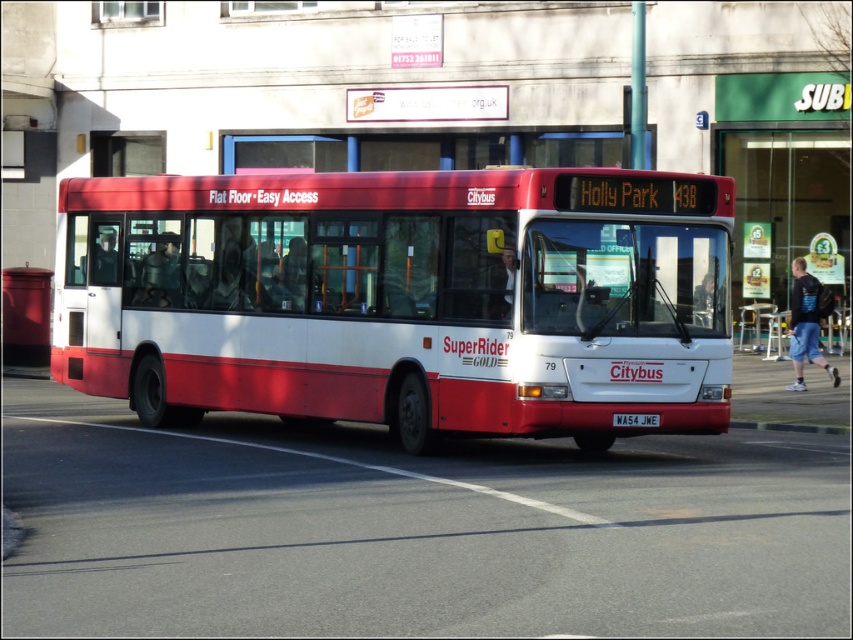
Question: Which point is closer to the camera?

Choices:
 (A) (517, 426)
 (B) (717, 163)

Answer: (A)

Question: Does matte red bus at center appear on the right side of green glass door at upper center?

Choices:
 (A) yes
 (B) no

Answer: (B)

Question: Can you confirm if matte red bus at center is bigger than green glass door at upper center?

Choices:
 (A) no
 (B) yes

Answer: (B)

Question: Is matte red bus at center to the right of green glass door at upper center from the viewer's perspective?

Choices:
 (A) no
 (B) yes

Answer: (A)

Question: Which point appears closest to the camera in this image?

Choices:
 (A) (680, 314)
 (B) (786, 237)

Answer: (A)